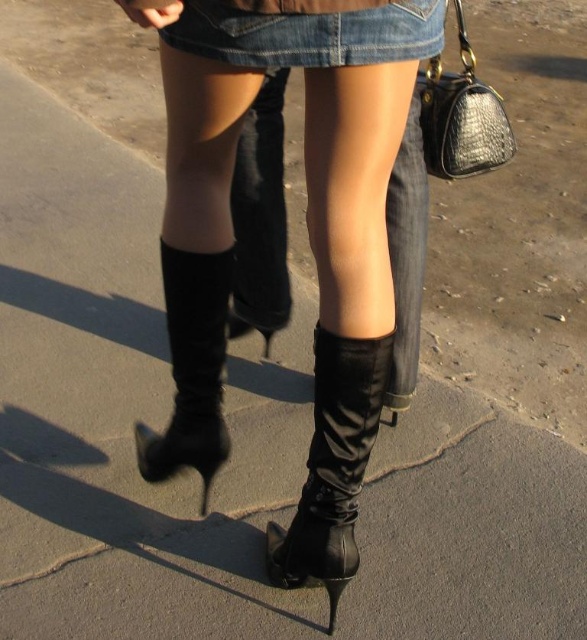
Between satin black boots at center and black leather boot at lower center, which one appears on the right side from the viewer's perspective?

satin black boots at center is more to the right.

Between satin black boots at center and black leather boot at lower center, which one has less height?

Standing shorter between the two is black leather boot at lower center.

Locate an element on the screen. This screenshot has width=587, height=640. satin black boots at center is located at coordinates (345, 312).

Who is taller, satin black boots at center or black leather boots at lower center?

satin black boots at center

Who is more distant from viewer, (376, 104) or (214, 317)?

Point (214, 317)

The width and height of the screenshot is (587, 640). What are the coordinates of `satin black boots at center` in the screenshot? It's located at (345, 312).

Is point (359, 26) closer to viewer compared to point (187, 292)?

Yes, it is.

Between denim shorts at upper center and black leather boot at lower center, which one appears on the left side from the viewer's perspective?

black leather boot at lower center

What are the coordinates of `denim shorts at upper center` in the screenshot? It's located at (308, 35).

This screenshot has height=640, width=587. Identify the location of denim shorts at upper center. (308, 35).